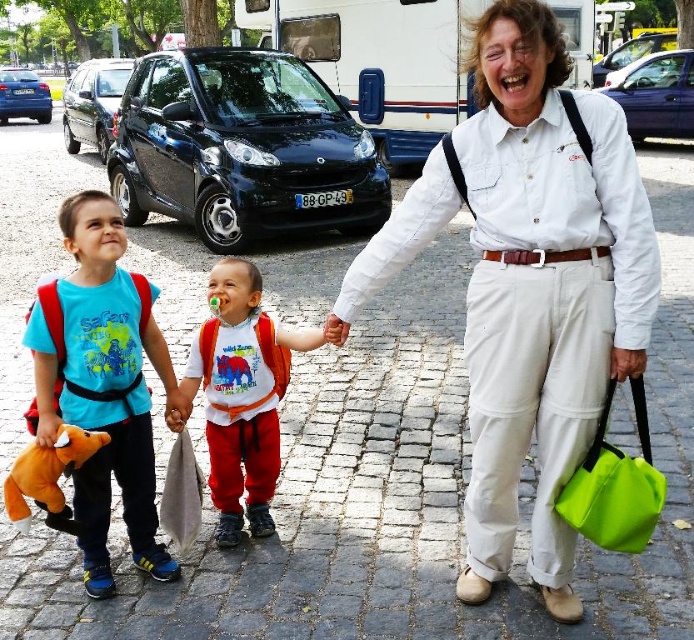
Is point (450, 180) positioned after point (121, 241)?

That is False.

Which is behind, point (520, 307) or point (110, 582)?

Positioned behind is point (110, 582).

What are the coordinates of `white cotton shirt at center` in the screenshot? It's located at (530, 284).

Does blue cotton shirt at left lie behind soft plush toy at left?

Yes.

Can you confirm if blue cotton shirt at left is shorter than soft plush toy at left?

No.

Is point (126, 506) positioned before point (78, 456)?

No, it is not.

The image size is (694, 640). In order to click on blue cotton shirt at left in this screenshot , I will do `click(101, 385)`.

Is white cotton shirt at center taller than soft plush toy at left?

Indeed, white cotton shirt at center has a greater height compared to soft plush toy at left.

Does white cotton shirt at center come in front of soft plush toy at left?

Yes, it is in front of soft plush toy at left.

Which is behind, point (550, 500) or point (74, 465)?

The point (74, 465) is more distant.

The image size is (694, 640). I want to click on white cotton shirt at center, so click(530, 284).